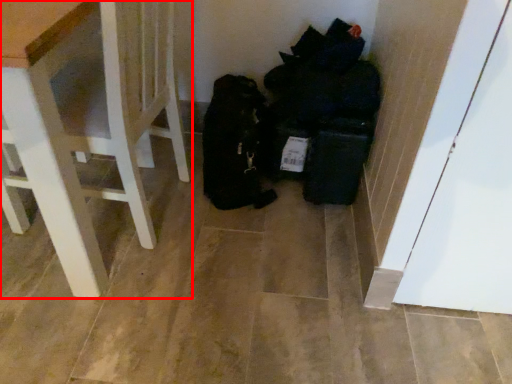
Question: From the image's perspective, considering the relative positions of furniture (annotated by the red box) and garbage in the image provided, where is furniture (annotated by the red box) located with respect to the staircase?

Choices:
 (A) above
 (B) below

Answer: (B)